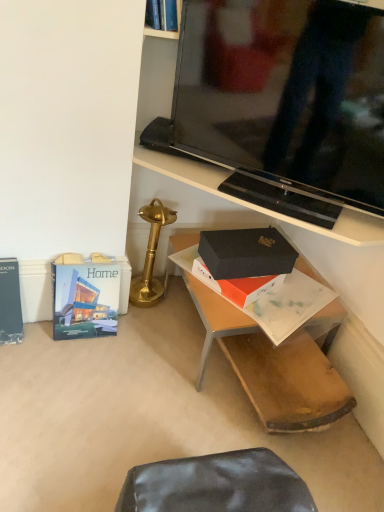
Where is `empty space that is ontop of black matte box at center`? The width and height of the screenshot is (384, 512). empty space that is ontop of black matte box at center is located at coordinates (254, 294).